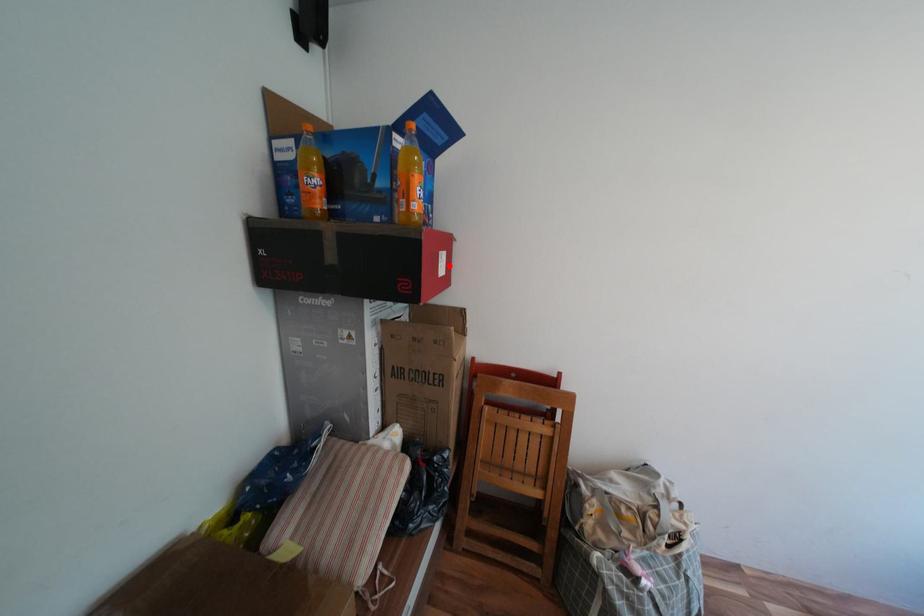
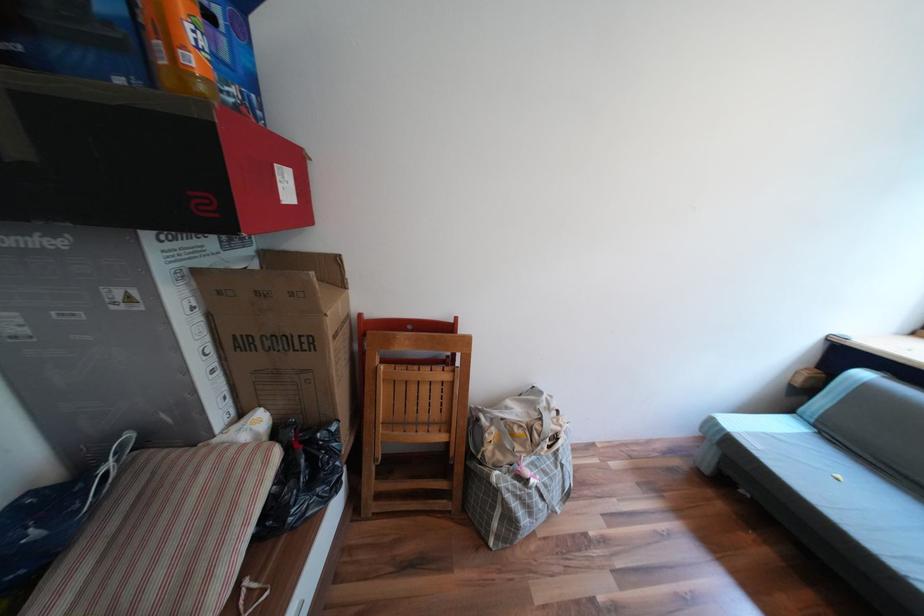
Find the pixel in the second image that matches the highlighted location in the first image.

(289, 185)